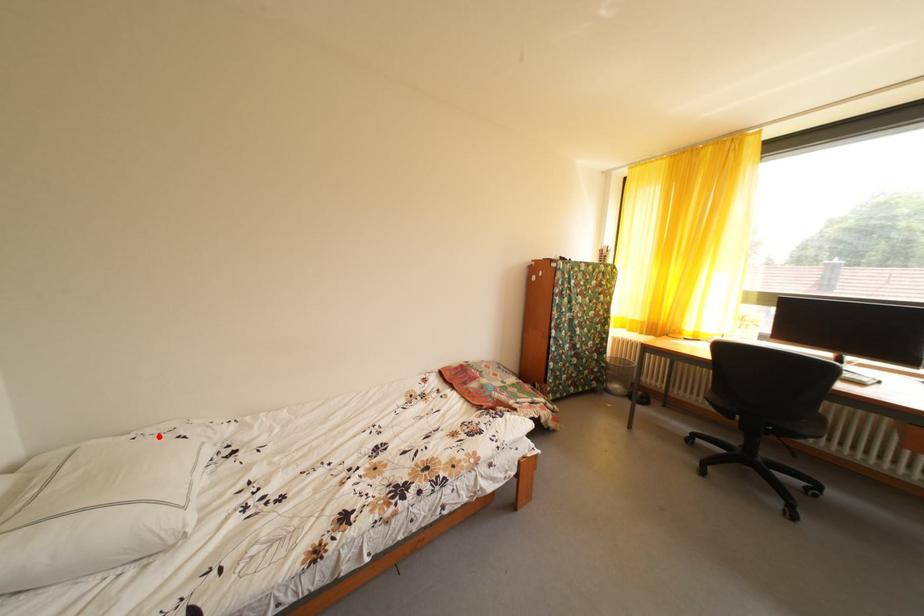
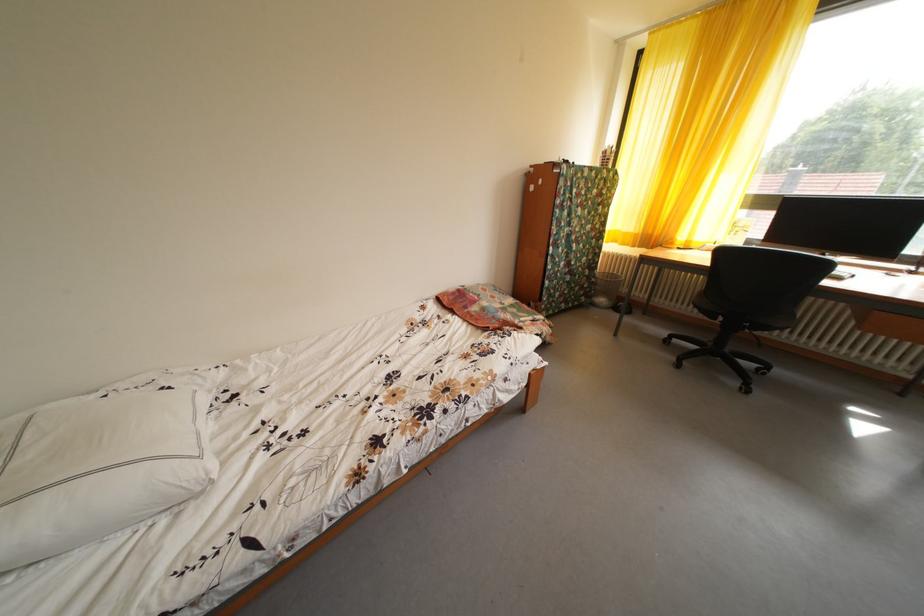
In the second image, find the point that corresponds to the highlighted location in the first image.

(131, 391)